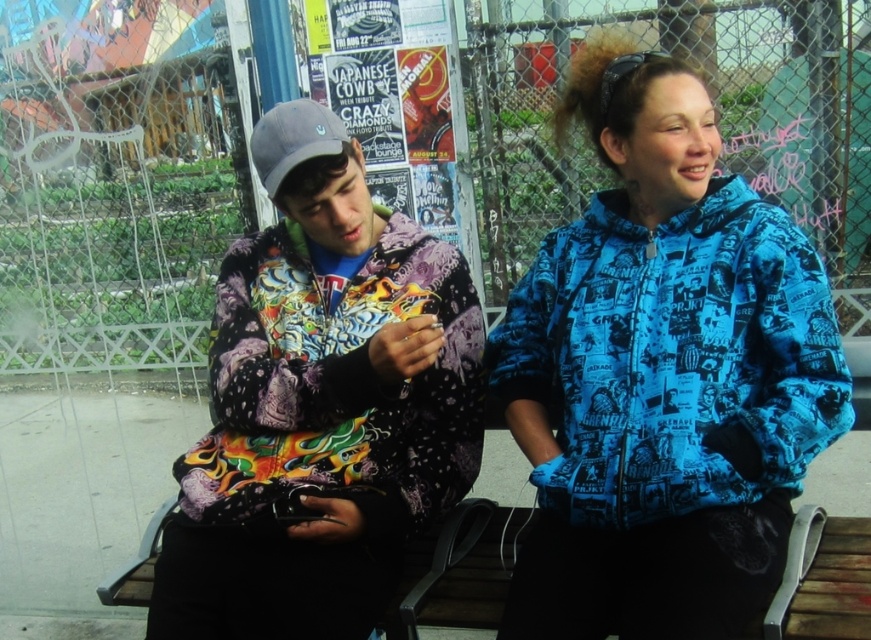
Question: Observing the image, what is the correct spatial positioning of printed fabric hoodie at left in reference to blue printed jacket at upper right?

Choices:
 (A) below
 (B) above

Answer: (A)

Question: Does printed fabric hoodie at left have a smaller size compared to blue printed jacket at upper right?

Choices:
 (A) yes
 (B) no

Answer: (B)

Question: Which point is closer to the camera?

Choices:
 (A) printed fabric hoodie at left
 (B) blue printed jacket at upper right

Answer: (B)

Question: Does printed fabric hoodie at left have a lesser width compared to blue printed jacket at upper right?

Choices:
 (A) no
 (B) yes

Answer: (A)

Question: Which point is closer to the camera taking this photo?

Choices:
 (A) [647, 502]
 (B) [327, 566]

Answer: (A)

Question: Which point is closer to the camera?

Choices:
 (A) printed fabric hoodie at left
 (B) blue printed jacket at upper right

Answer: (B)